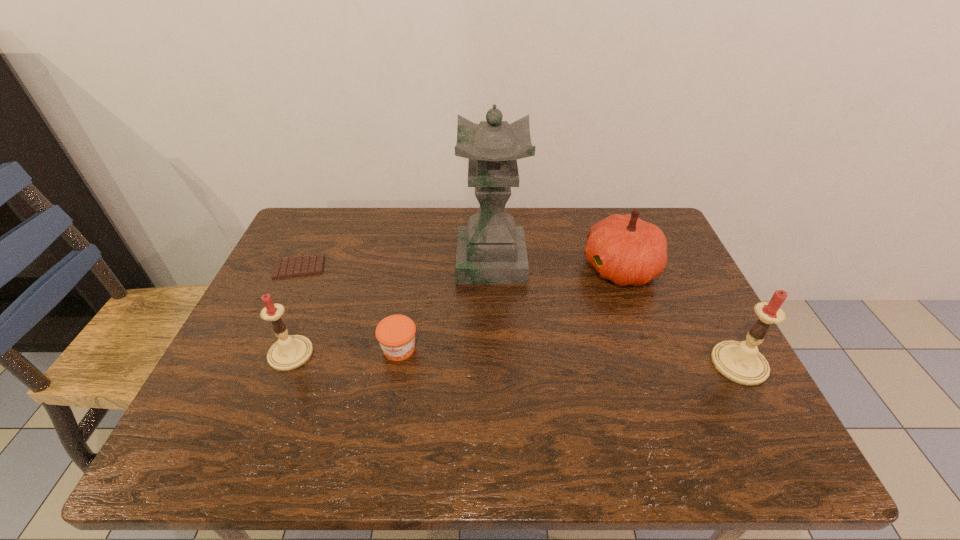
You are a GUI agent. You are given a task and a screenshot of the screen. Output one action in this format:
    pyautogui.click(x=<x>, y=<y>)
    Task: Click on the location for an additional candle to make spacing equal
    
    Given the screenshot: What is the action you would take?
    pyautogui.click(x=513, y=359)